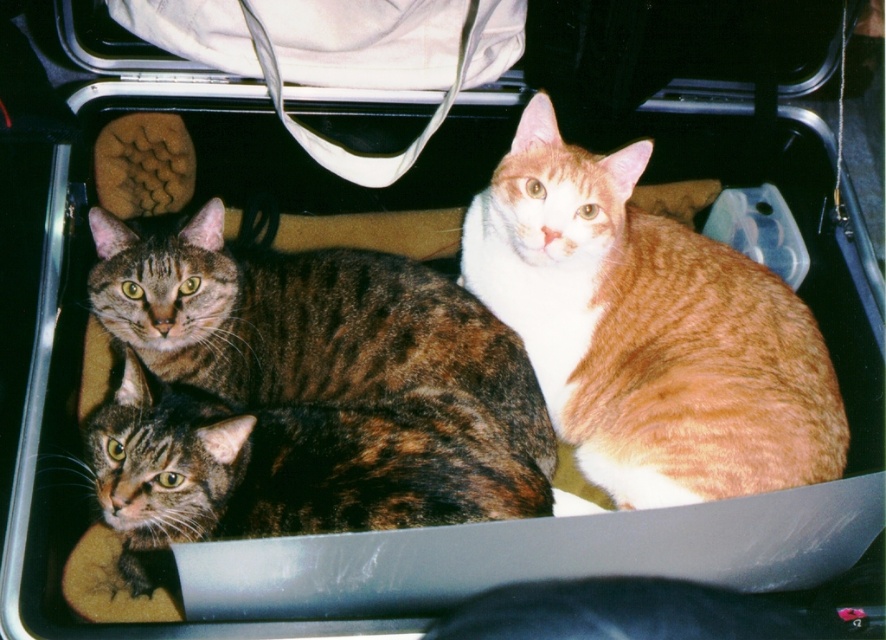
In the scene shown: Is orange tabby cat at center above brown tabby cat at center?

Indeed, orange tabby cat at center is positioned over brown tabby cat at center.

Does orange tabby cat at center have a lesser width compared to brown tabby cat at center?

Yes, orange tabby cat at center is thinner than brown tabby cat at center.

Who is more distant from viewer, [631,148] or [160,465]?

Point [631,148]

This screenshot has width=886, height=640. What are the coordinates of `orange tabby cat at center` in the screenshot? It's located at (649, 330).

Consider the image. Is orange tabby cat at center positioned behind dark brown fur cat at center?

No, orange tabby cat at center is in front of dark brown fur cat at center.

Is orange tabby cat at center below dark brown fur cat at center?

Yes.

Does point (557, 176) lie behind point (537, 467)?

Yes, point (557, 176) is behind point (537, 467).

Identify the location of orange tabby cat at center. The image size is (886, 640). (649, 330).

Is dark brown fur cat at center above brown tabby cat at center?

Yes.

Is point (146, 269) farther from camera compared to point (523, 490)?

That is True.

Locate an element on the screen. The height and width of the screenshot is (640, 886). dark brown fur cat at center is located at coordinates (307, 324).